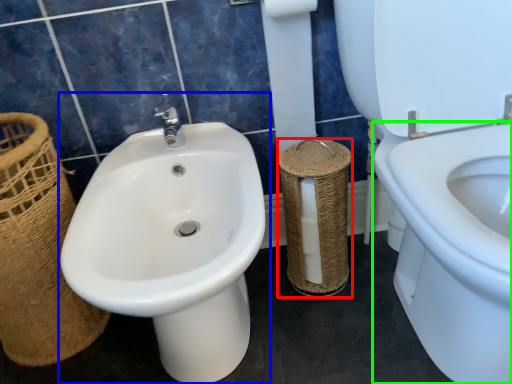
Question: Which is nearer to the basket container (highlighted by a red box)? sink (highlighted by a blue box) or bidet (highlighted by a green box).

Choices:
 (A) sink
 (B) bidet

Answer: (B)